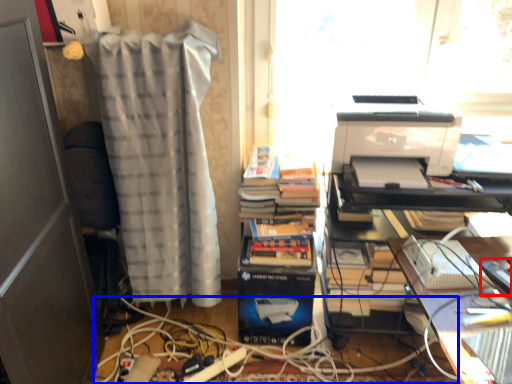
Question: Which of the following is the closest to the observer, equipment (highlighted by a red box) or cable (highlighted by a blue box)?

Choices:
 (A) equipment
 (B) cable

Answer: (A)